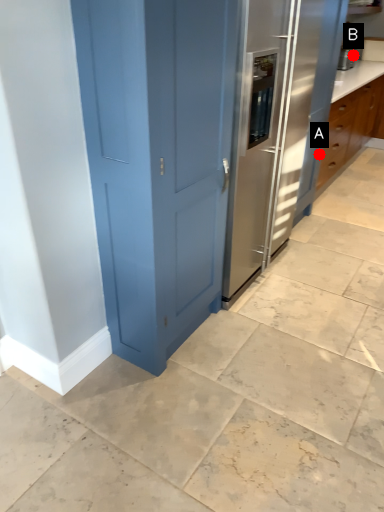
Question: Two points are circled on the image, labeled by A and B beside each circle. Which of the following is the closest to the observer?

Choices:
 (A) A is closer
 (B) B is closer

Answer: (A)